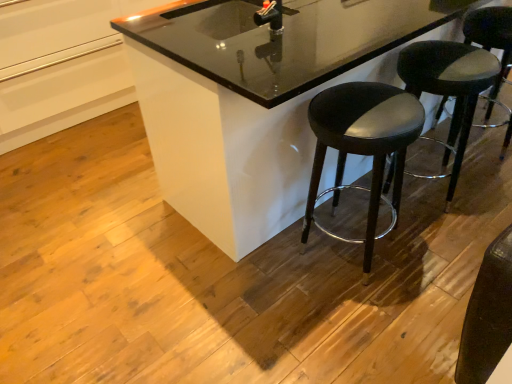
What are the coordinates of `vacant position to the left of black leather stool at center, the first stool in the left-to-right sequence` in the screenshot? It's located at [x=269, y=271].